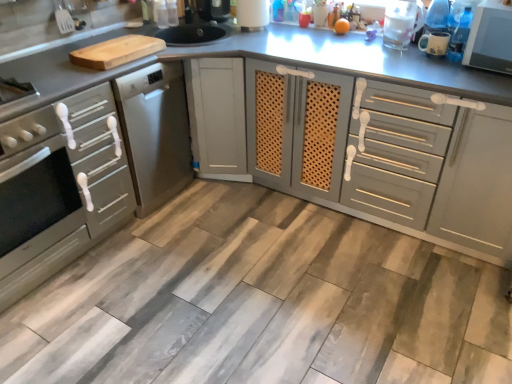
What is the approximate height of satin silver oven at left?

satin silver oven at left is 26.74 inches tall.

Where is `white textured paper towel holder at upper center, which ranks as the first appliance in left-to-right order`? The width and height of the screenshot is (512, 384). white textured paper towel holder at upper center, which ranks as the first appliance in left-to-right order is located at coordinates (252, 15).

Where is `matte gray cabinet at center, the 1th cabinetry from the right`? The image size is (512, 384). matte gray cabinet at center, the 1th cabinetry from the right is located at coordinates (389, 158).

I want to click on matte white mug at upper right, the third appliance when ordered from left to right, so click(x=434, y=44).

This screenshot has width=512, height=384. Describe the element at coordinates (434, 44) in the screenshot. I see `matte white mug at upper right, the third appliance when ordered from left to right` at that location.

Image resolution: width=512 pixels, height=384 pixels. What do you see at coordinates (402, 22) in the screenshot? I see `transparent plastic pitcher at upper right, the second appliance positioned from the right` at bounding box center [402, 22].

What is the approximate width of transparent plastic pitcher at upper right, the 2th appliance from the front?

The width of transparent plastic pitcher at upper right, the 2th appliance from the front, is 6.21 inches.

The height and width of the screenshot is (384, 512). I want to click on matte gray oven at left, which is the first cabinetry in left-to-right order, so click(60, 187).

In the scene shown: Considering the positions of objects white textured paper towel holder at upper center, which ranks as the first appliance in left-to-right order, and matte white mug at upper right, the third appliance when ordered from left to right, in the image provided, who is behind, white textured paper towel holder at upper center, which ranks as the first appliance in left-to-right order, or matte white mug at upper right, the third appliance when ordered from left to right,?

Positioned behind is white textured paper towel holder at upper center, which ranks as the first appliance in left-to-right order.

Which object is thinner, white textured paper towel holder at upper center, the 3th appliance in the right-to-left sequence, or matte white mug at upper right, which is the 3th appliance in back-to-front order?

matte white mug at upper right, which is the 3th appliance in back-to-front order.

Is white textured paper towel holder at upper center, which ranks as the first appliance in left-to-right order, not near matte white mug at upper right, which is the 3th appliance in back-to-front order?

No, there isn't a large distance between white textured paper towel holder at upper center, which ranks as the first appliance in left-to-right order, and matte white mug at upper right, which is the 3th appliance in back-to-front order.

Does point (240, 6) lie in front of point (429, 32)?

No, it is behind (429, 32).

Is matte gray cabinet at center, the second cabinetry when ordered from left to right, positioned with its back to matte gray oven at left, which is the first cabinetry in left-to-right order?

No, matte gray oven at left, which is the first cabinetry in left-to-right order, is not at the back of matte gray cabinet at center, the second cabinetry when ordered from left to right.

Is matte gray cabinet at center, the second cabinetry when ordered from left to right, beside matte gray oven at left, which is the first cabinetry in left-to-right order?

There is a gap between matte gray cabinet at center, the second cabinetry when ordered from left to right, and matte gray oven at left, which is the first cabinetry in left-to-right order.

Which object is further away from the camera, matte gray cabinet at center, the second cabinetry when ordered from left to right, or matte gray oven at left, which appears as the second cabinetry when viewed from the right?

Positioned behind is matte gray oven at left, which appears as the second cabinetry when viewed from the right.

Considering the positions of objects matte gray cabinet at center, the second cabinetry when ordered from left to right, and matte gray oven at left, which is the first cabinetry in left-to-right order, in the image provided, who is more to the left, matte gray cabinet at center, the second cabinetry when ordered from left to right, or matte gray oven at left, which is the first cabinetry in left-to-right order,?

matte gray oven at left, which is the first cabinetry in left-to-right order.

From the image's perspective, which one is positioned lower, matte gray oven at left, which is the first cabinetry in left-to-right order, or white glossy microwave at upper right?

matte gray oven at left, which is the first cabinetry in left-to-right order.

Is matte gray oven at left, which is the first cabinetry in left-to-right order, shorter than white glossy microwave at upper right?

No.

Is matte gray oven at left, which appears as the second cabinetry when viewed from the right, thinner than white glossy microwave at upper right?

Incorrect, the width of matte gray oven at left, which appears as the second cabinetry when viewed from the right, is not less than that of white glossy microwave at upper right.

In order to click on home appliance lying on the right of matte gray oven at left, which is the first cabinetry in left-to-right order in this screenshot , I will do `click(490, 38)`.

Does point (431, 44) lie behind point (480, 42)?

That is True.

Which of these two, matte white mug at upper right, which is the first appliance in front-to-back order, or white glossy microwave at upper right, is smaller?

matte white mug at upper right, which is the first appliance in front-to-back order.

Is matte white mug at upper right, which is the 3th appliance in back-to-front order, not close to white glossy microwave at upper right?

No.

Locate an element on the screen. The height and width of the screenshot is (384, 512). appliance that is the 2nd one when counting upward from the matte gray oven at left, which is the first cabinetry in left-to-right order (from the image's perspective) is located at coordinates (402, 22).

From a real-world perspective, which object stands above the other?

transparent plastic pitcher at upper right, marked as the 2th appliance in a left-to-right arrangement, is physically above.

Between transparent plastic pitcher at upper right, the second appliance positioned from the right, and matte gray oven at left, which appears as the second cabinetry when viewed from the right, which one appears on the left side from the viewer's perspective?

From the viewer's perspective, matte gray oven at left, which appears as the second cabinetry when viewed from the right, appears more on the left side.

Is white textured paper towel holder at upper center, which ranks as the first appliance in left-to-right order, positioned far away from transparent plastic pitcher at upper right, marked as the 2th appliance in a left-to-right arrangement?

Actually, white textured paper towel holder at upper center, which ranks as the first appliance in left-to-right order, and transparent plastic pitcher at upper right, marked as the 2th appliance in a left-to-right arrangement, are a little close together.

Who is smaller, white textured paper towel holder at upper center, placed as the third appliance when sorted from front to back, or transparent plastic pitcher at upper right, marked as the 2th appliance in a left-to-right arrangement?

With smaller size is white textured paper towel holder at upper center, placed as the third appliance when sorted from front to back.

Consider the image. From a real-world perspective, is white textured paper towel holder at upper center, placed as the 1th appliance when sorted from back to front, located beneath transparent plastic pitcher at upper right, marked as the 2th appliance in a left-to-right arrangement?

Yes.

Measure the distance between white textured paper towel holder at upper center, the 3th appliance in the right-to-left sequence, and satin silver oven at left.

white textured paper towel holder at upper center, the 3th appliance in the right-to-left sequence, is 4.95 feet away from satin silver oven at left.

What's the angular difference between white textured paper towel holder at upper center, which ranks as the first appliance in left-to-right order, and satin silver oven at left's facing directions?

white textured paper towel holder at upper center, which ranks as the first appliance in left-to-right order, and satin silver oven at left are facing 88.8 degrees away from each other.

From a real-world perspective, who is located higher, white textured paper towel holder at upper center, placed as the 1th appliance when sorted from back to front, or satin silver oven at left?

white textured paper towel holder at upper center, placed as the 1th appliance when sorted from back to front.

Considering the relative sizes of white textured paper towel holder at upper center, the 3th appliance in the right-to-left sequence, and satin silver oven at left in the image provided, is white textured paper towel holder at upper center, the 3th appliance in the right-to-left sequence, wider than satin silver oven at left?

No, white textured paper towel holder at upper center, the 3th appliance in the right-to-left sequence, is not wider than satin silver oven at left.

Identify the location of the 1st appliance located above the matte white mug at upper right, which is the 3th appliance in back-to-front order (from a real-world perspective). This screenshot has width=512, height=384. (252, 15).

I want to click on cabinetry located behind the matte gray cabinet at center, the second cabinetry when ordered from left to right, so click(x=60, y=187).

Which object lies further to the anchor point satin silver oven at left, transparent plastic pitcher at upper right, the 2th appliance viewed from the back, or matte white mug at upper right, which is the 3th appliance in back-to-front order?

matte white mug at upper right, which is the 3th appliance in back-to-front order, lies further to satin silver oven at left than the other object.

Consider the image. Which object lies nearer to the anchor point matte gray cabinet at center, the second cabinetry when ordered from left to right, transparent plastic pitcher at upper right, the 2th appliance from the front, or satin silver oven at left?

transparent plastic pitcher at upper right, the 2th appliance from the front.

Considering their positions, is transparent plastic pitcher at upper right, marked as the 2th appliance in a left-to-right arrangement, positioned closer to matte white mug at upper right, the third appliance when ordered from left to right, than satin silver oven at left?

Based on the image, transparent plastic pitcher at upper right, marked as the 2th appliance in a left-to-right arrangement, appears to be nearer to matte white mug at upper right, the third appliance when ordered from left to right.

Based on the photo, considering their positions, is white glossy microwave at upper right positioned closer to matte gray oven at left, which appears as the second cabinetry when viewed from the right, than white textured paper towel holder at upper center, the 3th appliance in the right-to-left sequence?

Based on the image, white textured paper towel holder at upper center, the 3th appliance in the right-to-left sequence, appears to be nearer to matte gray oven at left, which appears as the second cabinetry when viewed from the right.

Which object lies nearer to the anchor point matte gray cabinet at center, the second cabinetry when ordered from left to right, white glossy microwave at upper right or white textured paper towel holder at upper center, placed as the third appliance when sorted from front to back?

white glossy microwave at upper right lies closer to matte gray cabinet at center, the second cabinetry when ordered from left to right, than the other object.

From the image, which object appears to be farther from matte gray oven at left, which is the first cabinetry in left-to-right order, matte white mug at upper right, which is the first appliance in front-to-back order, or white glossy microwave at upper right?

Among the two, white glossy microwave at upper right is located further to matte gray oven at left, which is the first cabinetry in left-to-right order.

Based on their spatial positions, is satin silver oven at left or matte gray cabinet at center, the 1th cabinetry from the right, further from matte gray oven at left, which appears as the second cabinetry when viewed from the right?

Among the two, matte gray cabinet at center, the 1th cabinetry from the right, is located further to matte gray oven at left, which appears as the second cabinetry when viewed from the right.

When comparing their distances from satin silver oven at left, does white textured paper towel holder at upper center, which ranks as the first appliance in left-to-right order, or matte gray cabinet at center, the second cabinetry when ordered from left to right, seem further?

white textured paper towel holder at upper center, which ranks as the first appliance in left-to-right order, is further to satin silver oven at left.

Where is `appliance between matte gray oven at left, which appears as the second cabinetry when viewed from the right, and matte gray cabinet at center, the second cabinetry when ordered from left to right, from left to right`? appliance between matte gray oven at left, which appears as the second cabinetry when viewed from the right, and matte gray cabinet at center, the second cabinetry when ordered from left to right, from left to right is located at coordinates (252, 15).

What are the coordinates of `cabinetry between matte gray oven at left, which appears as the second cabinetry when viewed from the right, and transparent plastic pitcher at upper right, the 2th appliance from the front, in the horizontal direction` in the screenshot? It's located at (389, 158).

What are the coordinates of `appliance located between satin silver oven at left and matte gray cabinet at center, the 1th cabinetry from the right, in the left-right direction` in the screenshot? It's located at tap(252, 15).

The height and width of the screenshot is (384, 512). In order to click on appliance between matte gray cabinet at center, the 1th cabinetry from the right, and transparent plastic pitcher at upper right, marked as the 2th appliance in a left-to-right arrangement, from front to back in this screenshot , I will do coord(434,44).